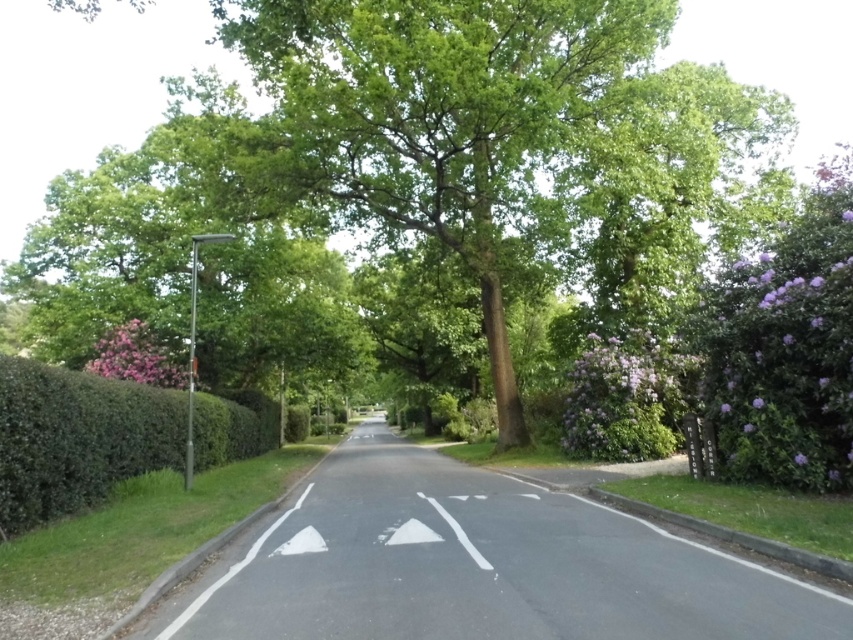
Question: Does green leafy hedge at left appear over purple leafy bush at right?

Choices:
 (A) no
 (B) yes

Answer: (A)

Question: Among these points, which one is nearest to the camera?

Choices:
 (A) (56, 433)
 (B) (550, 214)
 (C) (662, 353)

Answer: (A)

Question: Does green leafy tree at center appear on the left side of purple leafy bush at right?

Choices:
 (A) yes
 (B) no

Answer: (A)

Question: Which point is farther to the camera?

Choices:
 (A) (405, 205)
 (B) (4, 492)
 (C) (579, 412)

Answer: (A)

Question: Can you confirm if green leafy tree at center is positioned to the left of green leafy hedge at left?

Choices:
 (A) no
 (B) yes

Answer: (B)

Question: Which of the following is the closest to the observer?

Choices:
 (A) purple leafy bush at right
 (B) green leafy tree at center
 (C) green leafy hedge at left

Answer: (C)